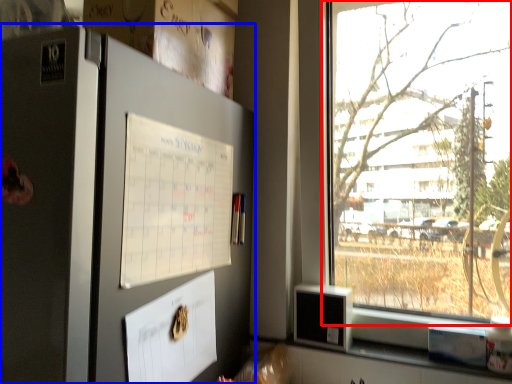
Question: Which object appears closest to the camera in this image, window (highlighted by a red box) or fridge (highlighted by a blue box)?

Choices:
 (A) window
 (B) fridge

Answer: (B)